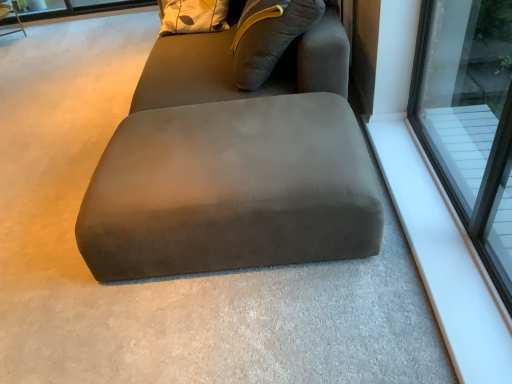
The image size is (512, 384). I want to click on free space to the left of suede gray bean bag at center, so click(x=74, y=109).